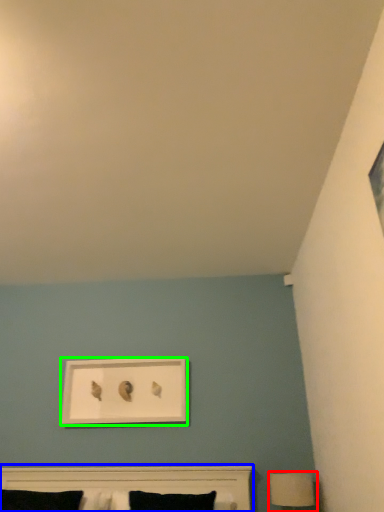
Question: Estimate the real-world distances between objects in this image. Which object is farther from table lamp (highlighted by a red box), bed (highlighted by a blue box) or picture frame (highlighted by a green box)?

Choices:
 (A) bed
 (B) picture frame

Answer: (B)